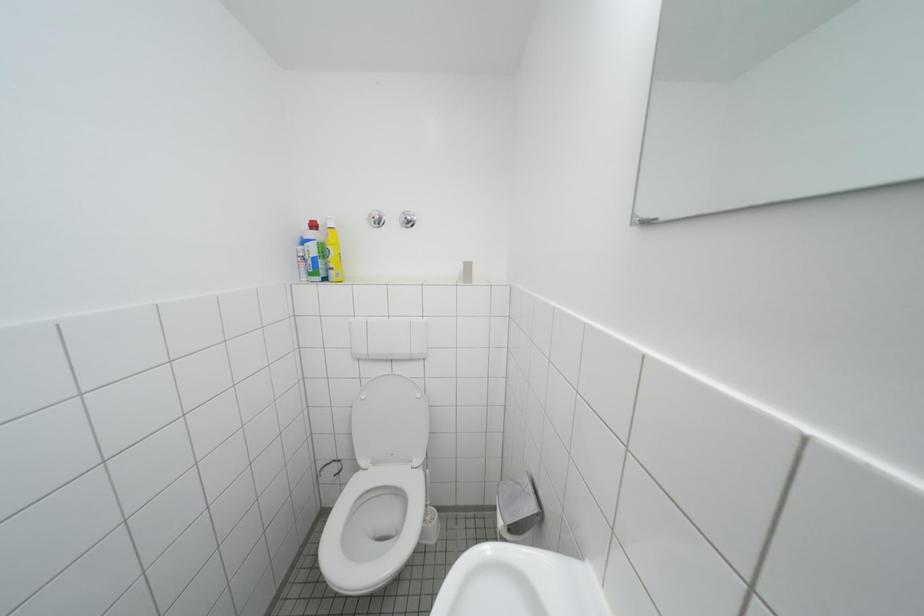
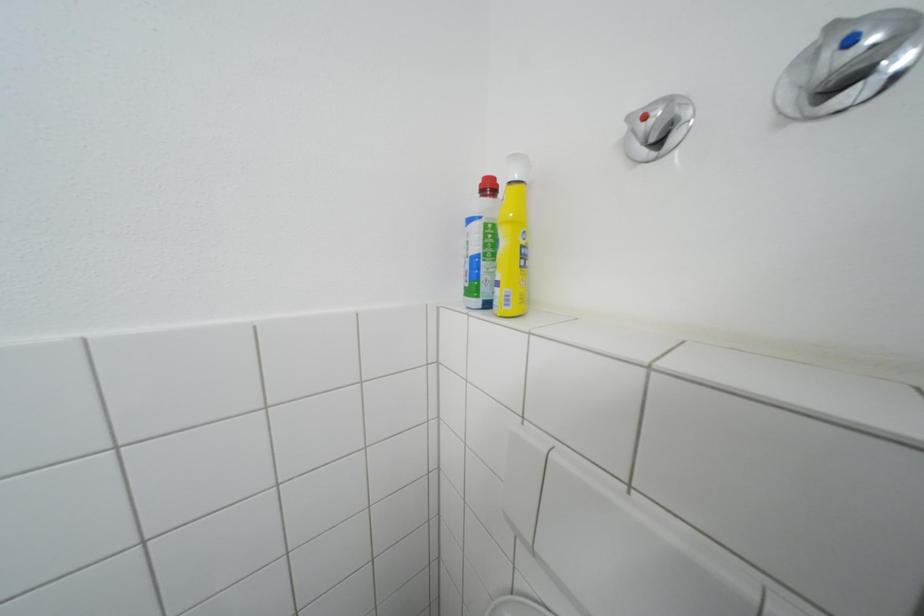
Question: The camera is either moving clockwise (left) or counter-clockwise (right) around the object. The first image is from the beginning of the video and the second image is from the end. Is the camera moving left or right when shooting the video?

Choices:
 (A) Left
 (B) Right

Answer: (B)